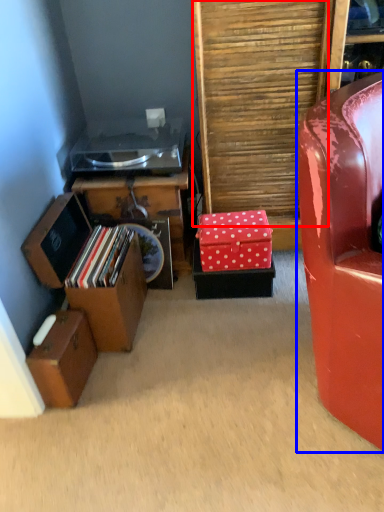
Question: Which point is closer to the camera, plywood (highlighted by a red box) or chair (highlighted by a blue box)?

Choices:
 (A) plywood
 (B) chair

Answer: (B)